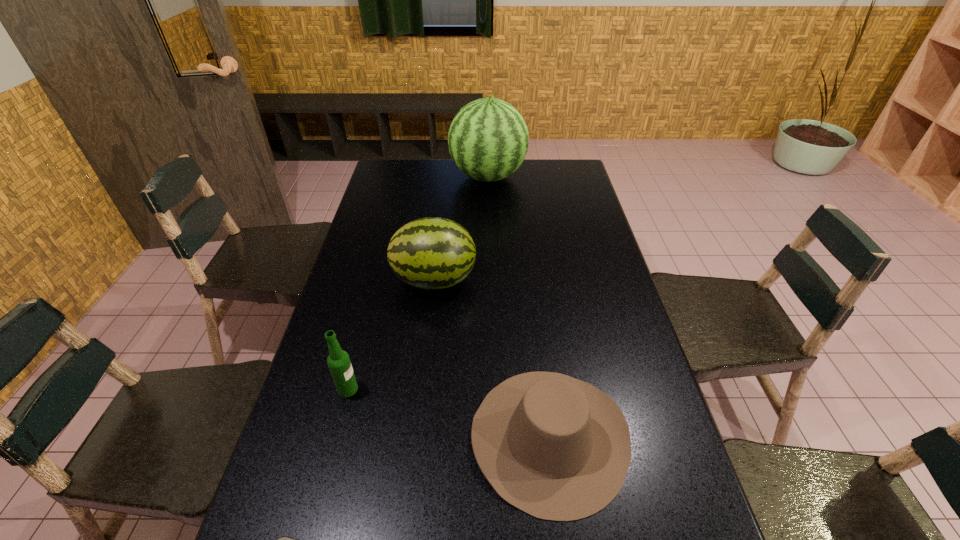
I want to click on blank region between the beer bottle and the nearer watermelon, so click(x=391, y=334).

Where is `vacant area that lies between the fourth tallest object and the beer bottle`? vacant area that lies between the fourth tallest object and the beer bottle is located at coordinates (448, 413).

Locate which object ranks fourth in proximity to the farthest object. Please provide its 2D coordinates. Your answer should be formatted as a tuple, i.e. [(x, y)], where the tuple contains the x and y coordinates of a point satisfying the conditions above.

[(283, 539)]

Where is `object that is the third closest one to the cowboy hat`? object that is the third closest one to the cowboy hat is located at coordinates (338, 361).

This screenshot has height=540, width=960. Find the location of `vacant region that satisfies the following two spatial constraints: 1. on the front side of the cowboy hat; 2. on the left side of the tallest object`. vacant region that satisfies the following two spatial constraints: 1. on the front side of the cowboy hat; 2. on the left side of the tallest object is located at coordinates (494, 437).

Locate an element on the screen. Image resolution: width=960 pixels, height=540 pixels. vacant space that satisfies the following two spatial constraints: 1. on the front side of the cowboy hat; 2. on the left side of the tallest object is located at coordinates (494, 437).

This screenshot has height=540, width=960. What are the coordinates of `free space that satisfies the following two spatial constraints: 1. on the front side of the tallest object; 2. at the stem end of the shorter watermelon` in the screenshot? It's located at (491, 280).

You are a GUI agent. You are given a task and a screenshot of the screen. Output one action in this format:
    pyautogui.click(x=<x>, y=<y>)
    Task: Click on the free spot that satisfies the following two spatial constraints: 1. at the stem end of the second shortest object; 2. on the right side of the nearer watermelon
    This screenshot has width=960, height=540.
    Given the screenshot: What is the action you would take?
    pyautogui.click(x=417, y=437)

The width and height of the screenshot is (960, 540). Identify the location of free space that satisfies the following two spatial constraints: 1. on the label of the beer bottle; 2. on the left side of the second shortest object. (335, 437).

Locate an element on the screen. The image size is (960, 540). free point that satisfies the following two spatial constraints: 1. at the stem end of the cowboy hat; 2. on the left side of the shorter watermelon is located at coordinates (417, 437).